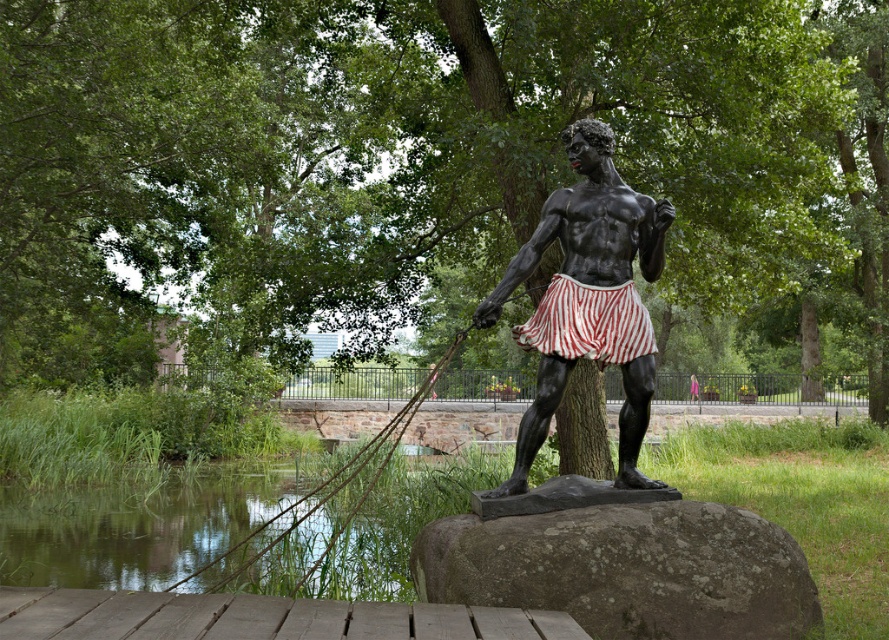
You are a photographer wanting to capture both the rough gray rock at center and the clear water at lower left in a single shot. Based on their positions, which object will appear larger in the photo?

The rough gray rock at center will appear larger in the photo because it is closer to the viewer than the clear water at lower left.

Based on the coordinates provided in the scene, where exactly is the rough gray rock at center located?

The rough gray rock at center is located at point (626, 570).